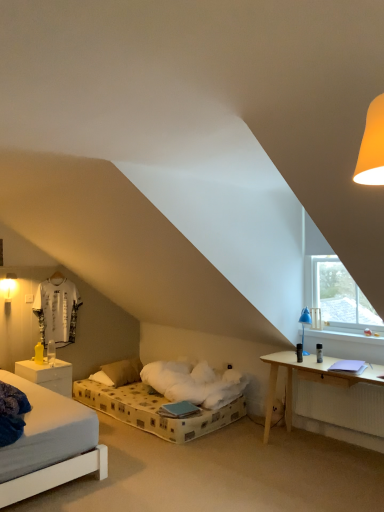
Locate an element on the screen. Image resolution: width=384 pixels, height=512 pixels. white jersey at left is located at coordinates (57, 310).

Image resolution: width=384 pixels, height=512 pixels. I want to click on blue plastic table lamp at right, so (x=305, y=323).

Measure the distance between transparent glass window at upper right and camera.

11.44 feet.

Measure the distance between point (58,367) and camera.

Point (58,367) is 13.53 feet from camera.

In order to click on matte white wall sconce at left in this screenshot , I will do `click(8, 286)`.

Looking at this image, which of these two, white matte nightstand at lower left or matte white wall sconce at left, is smaller?

matte white wall sconce at left is smaller.

Looking at this image, is matte white wall sconce at left a part of white matte nightstand at lower left?

No, white matte nightstand at lower left does not contain matte white wall sconce at left.

Considering the relative sizes of white matte nightstand at lower left and matte white wall sconce at left in the image provided, is white matte nightstand at lower left wider than matte white wall sconce at left?

Indeed, white matte nightstand at lower left has a greater width compared to matte white wall sconce at left.

Identify the location of nightstand below the matte white wall sconce at left (from the image's perspective). This screenshot has height=512, width=384. (47, 375).

From the image's perspective, does white jersey at left appear higher than transparent glass window at upper right?

No, from the image's perspective, white jersey at left is not over transparent glass window at upper right.

Is white jersey at left behind transparent glass window at upper right?

Yes, white jersey at left is further from the viewer.

Does white jersey at left appear on the left side of transparent glass window at upper right?

Correct, you'll find white jersey at left to the left of transparent glass window at upper right.

Does point (5, 294) lie in front of point (305, 315)?

No, (5, 294) is further to viewer.

Is matte white wall sconce at left turned away from blue plastic table lamp at right?

That's not correct — matte white wall sconce at left is not looking away from blue plastic table lamp at right.

Is matte white wall sconce at left surrounding blue plastic table lamp at right?

No, blue plastic table lamp at right is located outside of matte white wall sconce at left.

Can you tell me how much matte white wall sconce at left and white jersey at left differ in facing direction?

0.212 degrees.

Could you tell me if matte white wall sconce at left is facing white jersey at left?

No, matte white wall sconce at left is not aimed at white jersey at left.

From the image's perspective, relative to white jersey at left, is matte white wall sconce at left above or below?

Based on their image positions, matte white wall sconce at left is located above white jersey at left.

Could you tell me if blue plastic table lamp at right is turned towards transparent glass window at upper right?

No, blue plastic table lamp at right is not oriented towards transparent glass window at upper right.

Considering the sizes of objects blue plastic table lamp at right and transparent glass window at upper right in the image provided, who is smaller, blue plastic table lamp at right or transparent glass window at upper right?

blue plastic table lamp at right is smaller.

Looking at this image, which is correct: blue plastic table lamp at right is inside transparent glass window at upper right, or outside of it?

blue plastic table lamp at right is outside transparent glass window at upper right.

From a real-world perspective, between transparent glass window at upper right and white matte nightstand at lower left, who is vertically higher?

In real-world perspective, transparent glass window at upper right is above.

Does transparent glass window at upper right have a lesser height compared to white matte nightstand at lower left?

In fact, transparent glass window at upper right may be taller than white matte nightstand at lower left.

Is transparent glass window at upper right not inside white matte nightstand at lower left?

Yes, transparent glass window at upper right is outside of white matte nightstand at lower left.

Considering the positions of objects transparent glass window at upper right and white matte nightstand at lower left in the image provided, who is behind, transparent glass window at upper right or white matte nightstand at lower left?

white matte nightstand at lower left.

Is white jersey at left not inside white matte nightstand at lower left?

Yes, white jersey at left is located beyond the bounds of white matte nightstand at lower left.

From the image's perspective, who appears lower, white jersey at left or white matte nightstand at lower left?

white matte nightstand at lower left, from the image's perspective.

Are white jersey at left and white matte nightstand at lower left beside each other?

No.

Considering the relative sizes of white jersey at left and white matte nightstand at lower left in the image provided, is white jersey at left thinner than white matte nightstand at lower left?

Yes.

Locate an element on the screen. The image size is (384, 512). light fixture above the white matte nightstand at lower left (from the image's perspective) is located at coordinates (8, 286).

I want to click on sheet behind the transparent glass window at upper right, so click(x=57, y=310).

Looking at the image, which one is located further to white matte nightstand at lower left, matte white wall sconce at left or blue plastic table lamp at right?

blue plastic table lamp at right.

Estimate the real-world distances between objects in this image. Which object is closer to transparent glass window at upper right, white jersey at left or blue plastic table lamp at right?

blue plastic table lamp at right.

From the image, which object appears to be nearer to white jersey at left, blue plastic table lamp at right or matte white wall sconce at left?

matte white wall sconce at left is closer to white jersey at left.

Consider the image. Looking at the image, which one is located closer to matte white wall sconce at left, white jersey at left or transparent glass window at upper right?

white jersey at left lies closer to matte white wall sconce at left than the other object.

Looking at the image, which one is located closer to transparent glass window at upper right, matte white wall sconce at left or blue plastic table lamp at right?

The object closer to transparent glass window at upper right is blue plastic table lamp at right.

Consider the image. From the image, which object appears to be farther from matte white wall sconce at left, blue plastic table lamp at right or white jersey at left?

blue plastic table lamp at right.

Looking at the image, which one is located closer to matte white wall sconce at left, transparent glass window at upper right or blue plastic table lamp at right?

Based on the image, blue plastic table lamp at right appears to be nearer to matte white wall sconce at left.

Based on their spatial positions, is transparent glass window at upper right or white matte nightstand at lower left closer to matte white wall sconce at left?

white matte nightstand at lower left is closer to matte white wall sconce at left.

Find the location of `sheet between matte white wall sconce at left and white matte nightstand at lower left in the up-down direction`. sheet between matte white wall sconce at left and white matte nightstand at lower left in the up-down direction is located at coordinates (57, 310).

Identify the location of sheet between matte white wall sconce at left and transparent glass window at upper right. Image resolution: width=384 pixels, height=512 pixels. (57, 310).

You are a GUI agent. You are given a task and a screenshot of the screen. Output one action in this format:
    pyautogui.click(x=<x>, y=<y>)
    Task: Click on the table lamp between matte white wall sconce at left and transparent glass window at upper right
    The image size is (384, 512).
    Given the screenshot: What is the action you would take?
    pyautogui.click(x=305, y=323)

Locate an element on the screen. table lamp between white jersey at left and transparent glass window at upper right in the horizontal direction is located at coordinates (305, 323).